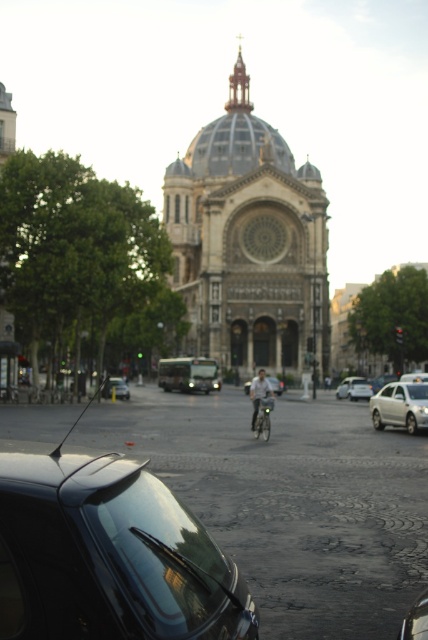
You are a photographer trying to capture the gray stone cathedral at center and the metallic silver car at center in a single frame. Based on their sizes in the image, which object appears larger?

The gray stone cathedral at center appears larger than the metallic silver car at center because it is taller.

You are a delivery person trying to park your vehicle in the parking lot near the cathedral. You have a shiny black car at center and a silver metallic sedan at center. Which vehicle will require more space to park?

The shiny black car at center requires more space to park because it is bigger than the silver metallic sedan at center.

You are a pedestrian standing on the cobblestone street in front of the cathedral. You see a shiny black car at center and a silver metallic sedan at center. Which vehicle is closer to the cathedral?

The shiny black car at center is closer to the cathedral because it is located below the silver metallic sedan at center, indicating it is positioned in front of it.